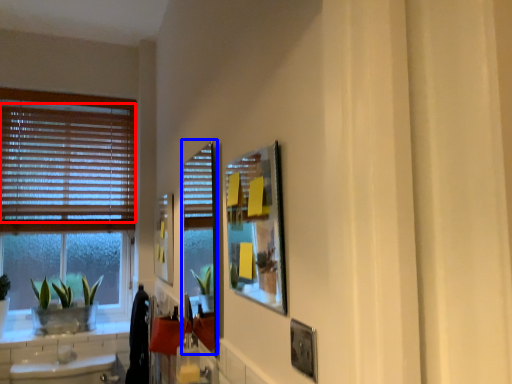
Question: Which point is further to the camera, blind (highlighted by a red box) or screen door (highlighted by a blue box)?

Choices:
 (A) blind
 (B) screen door

Answer: (A)